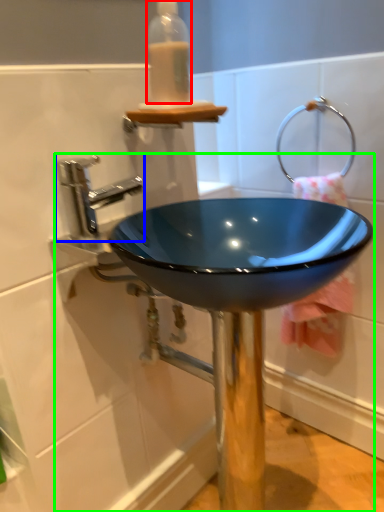
Question: Based on their relative distances, which object is nearer to bottle (highlighted by a red box)? Choose from tap (highlighted by a blue box) and sink (highlighted by a green box).

Choices:
 (A) tap
 (B) sink

Answer: (A)